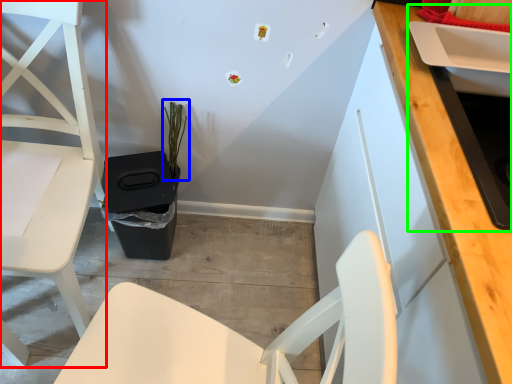
Question: Which object is the closest to the chair (highlighted by a red box)? Choose among these: plant (highlighted by a blue box) or sink (highlighted by a green box).

Choices:
 (A) plant
 (B) sink

Answer: (A)